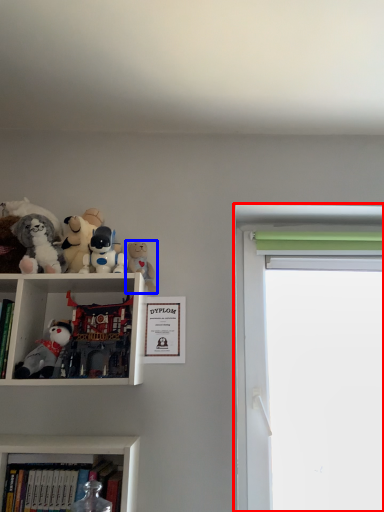
Question: Which of the following is the farthest to the observer, window screen (highlighted by a red box) or toy (highlighted by a blue box)?

Choices:
 (A) window screen
 (B) toy

Answer: (A)